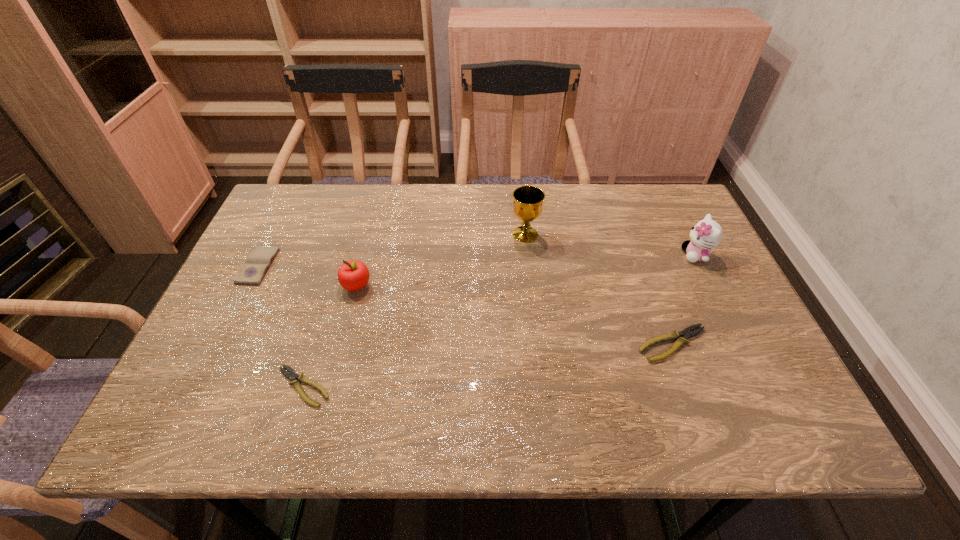
Locate an element on the screen. The width and height of the screenshot is (960, 540). the left pliers is located at coordinates (291, 375).

At what (x,y) coordinates should I click in order to perform the action: click on the shorter pliers. Please return your answer as a coordinate pair (x, y). Looking at the image, I should click on (291, 375).

At what (x,y) coordinates should I click in order to perform the action: click on the second nearest object. Please return your answer as a coordinate pair (x, y). This screenshot has width=960, height=540. Looking at the image, I should click on (687, 333).

Where is `the second shortest object`? Image resolution: width=960 pixels, height=540 pixels. the second shortest object is located at coordinates (687, 333).

The height and width of the screenshot is (540, 960). Identify the location of the leftmost object. (252, 272).

I want to click on diary, so click(x=252, y=272).

Where is `the fourth shortest object`? The image size is (960, 540). the fourth shortest object is located at coordinates (353, 275).

At what (x,y) coordinates should I click in order to perform the action: click on the fifth shortest object. Please return your answer as a coordinate pair (x, y). The image size is (960, 540). Looking at the image, I should click on (706, 234).

Where is `kitten`? Image resolution: width=960 pixels, height=540 pixels. kitten is located at coordinates (706, 234).

Locate an element on the screen. This screenshot has width=960, height=540. chalice is located at coordinates (528, 200).